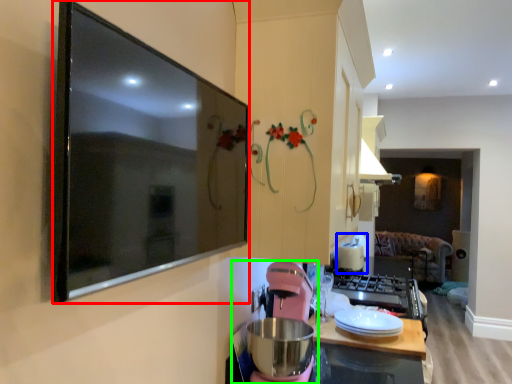
Question: Which is nearer to the picture frame (highlighted by a red box)? appliance (highlighted by a blue box) or blender (highlighted by a green box).

Choices:
 (A) appliance
 (B) blender

Answer: (B)